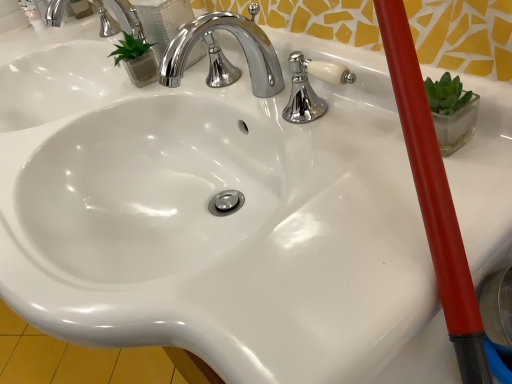
Where is `free space in front of chrome/metallic faucet at center, the second tap positioned from the top`? This screenshot has width=512, height=384. free space in front of chrome/metallic faucet at center, the second tap positioned from the top is located at coordinates (248, 107).